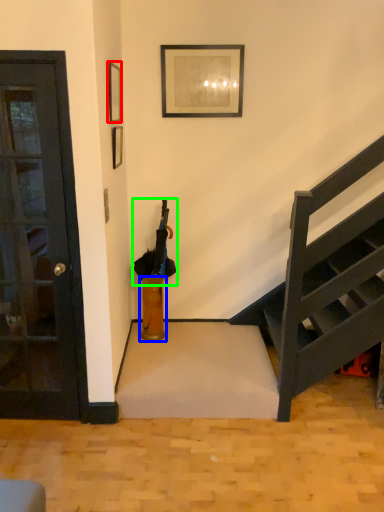
Question: Based on their relative distances, which object is nearer to picture frame (highlighted by a red box)? Choose from vase (highlighted by a blue box) and umbrella (highlighted by a green box).

Choices:
 (A) vase
 (B) umbrella

Answer: (B)